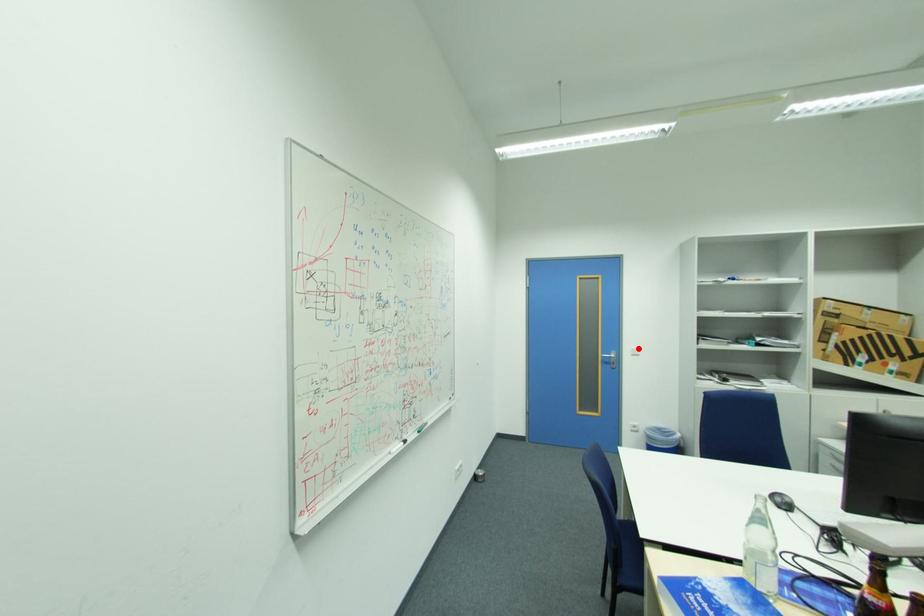
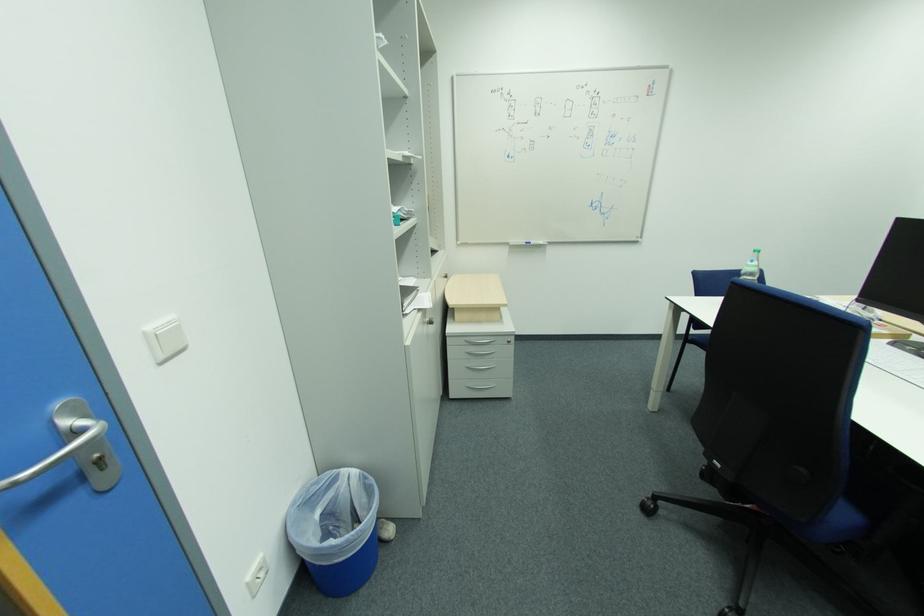
Find the pixel in the second image that matches the highlighted location in the first image.

(154, 329)